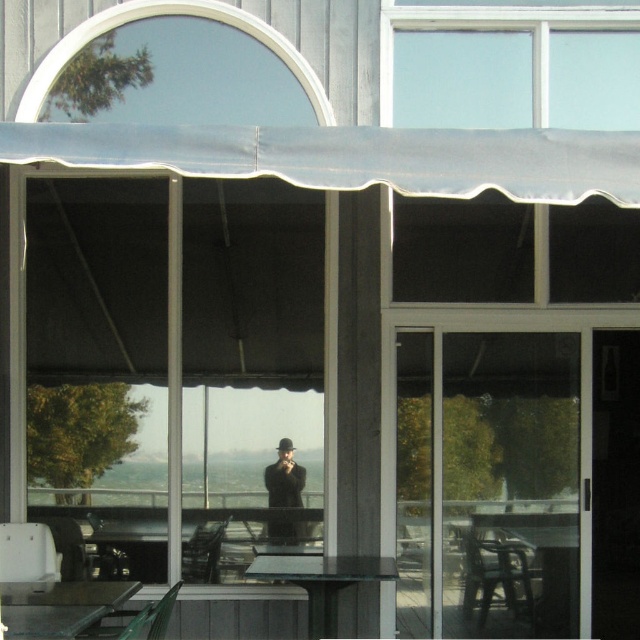
You are sitting at the transparent glass table at center and want to hand a document to the person wearing the black matte coat at center. Since the table is in the way, can you still reach them directly without moving the table?

The transparent glass table at center is closer to the viewer than the black matte coat at center, so the table is between you and the person. You would need to move the table to reach them directly.

You are standing at the entrance of the modern architectural structure with large glass windows and sliding doors. You want to place your bag on the metallic silver table at lower left. Where exactly should you look to find it?

The metallic silver table at lower left is located at point (60,605), so you should look towards the lower left corner of the structure near that coordinate to find it.